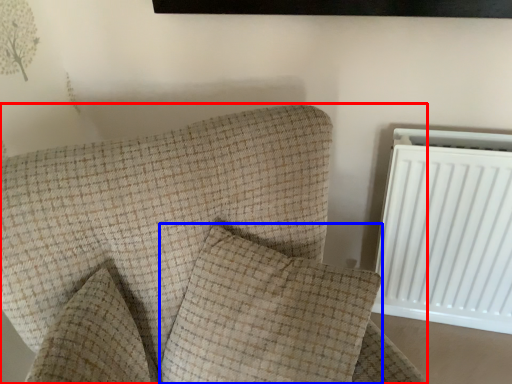
Question: Which object is closer to the camera taking this photo, furniture (highlighted by a red box) or pillow (highlighted by a blue box)?

Choices:
 (A) furniture
 (B) pillow

Answer: (A)